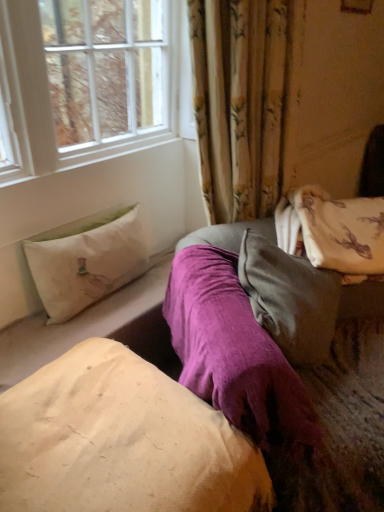
Question: Is white fabric pillow at left, which appears as the 1th pillow when viewed from the top, taller or shorter than beige cotton pillow at center, placed as the 1th pillow when sorted from bottom to top?

Choices:
 (A) tall
 (B) short

Answer: (B)

Question: From the image's perspective, is white fabric pillow at left, placed as the 3th pillow when sorted from bottom to top, located above or below beige cotton pillow at center, which is the 3th pillow in top-to-bottom order?

Choices:
 (A) above
 (B) below

Answer: (A)

Question: Estimate the real-world distances between objects in this image. Which object is closer to the beige cotton pillow at center, which is the 3th pillow in top-to-bottom order?

Choices:
 (A) velvety gray pillow at center, arranged as the 2th pillow when viewed from the top
 (B) white fabric pillow at left, which appears as the 1th pillow when viewed from the top

Answer: (A)

Question: Estimate the real-world distances between objects in this image. Which object is farther from the white fabric pillow at left, which appears as the 1th pillow when viewed from the top?

Choices:
 (A) beige cotton pillow at center, which is the 3th pillow in top-to-bottom order
 (B) velvety gray pillow at center, marked as the 2th pillow in a bottom-to-top arrangement

Answer: (B)